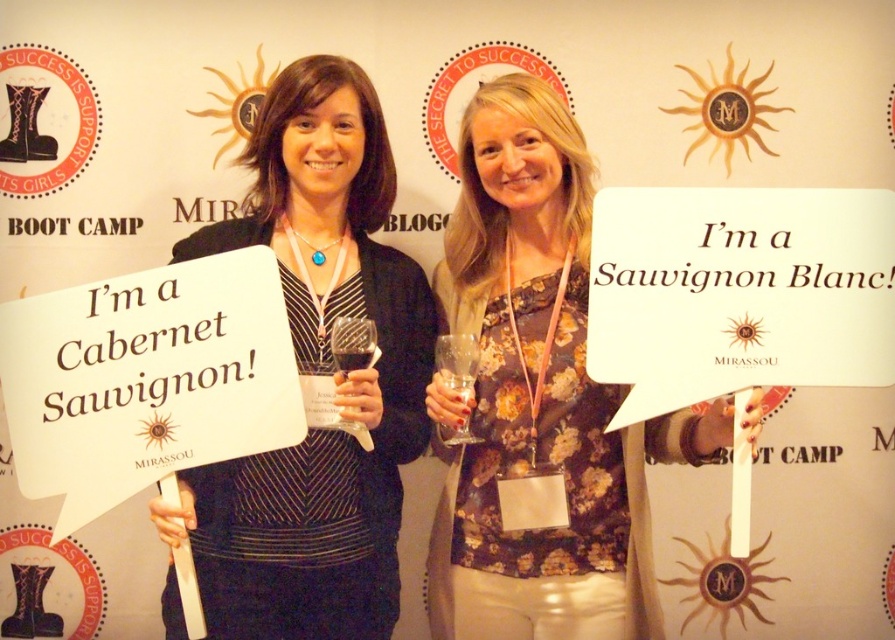
You are a photographer setting up for a photo shoot with the two women described in the scene. You need to ensure that the floral print blouse at center and the transparent glass wine glass at center are both visible in the shot. Given their sizes, which object should you focus on to ensure both are in frame without cropping?

The floral print blouse at center is bigger than the transparent glass wine glass at center, so you should focus on the larger floral print blouse at center to ensure both objects fit within the frame.

You are at a wine tasting event and see two women holding wine glasses. The woman on the left holds a clear glass wine glass at center, and the woman on the right holds a transparent glass wine glass at center. Which glass is taller?

The clear glass wine glass at center is taller than the transparent glass wine glass at center.